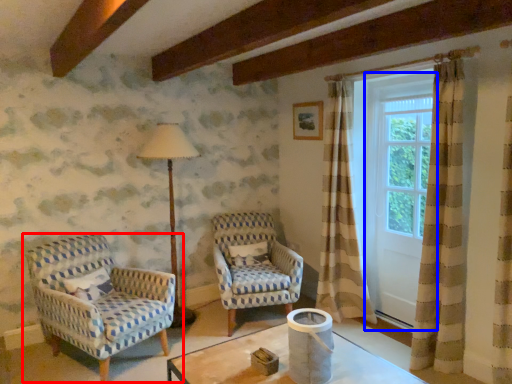
Question: Which of the following is the closest to the observer, chair (highlighted by a red box) or screen door (highlighted by a blue box)?

Choices:
 (A) chair
 (B) screen door

Answer: (A)